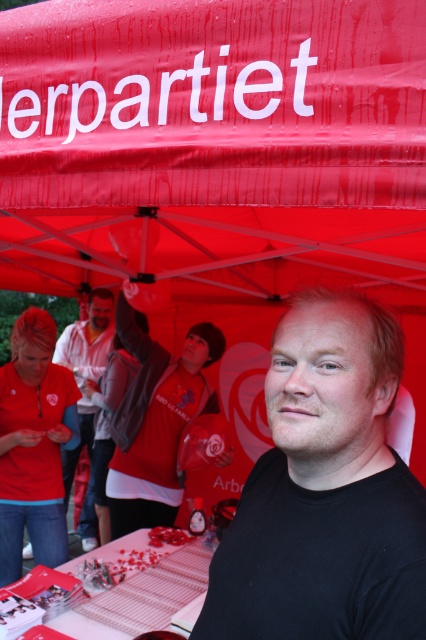
Between black matte shirt at center and matte plastic table at center, which one appears on the left side from the viewer's perspective?

Positioned to the left is matte plastic table at center.

How distant is black matte shirt at center from matte plastic table at center?

black matte shirt at center and matte plastic table at center are 1.14 meters apart from each other.

Does point (262, 500) come behind point (114, 592)?

No.

Find the location of a particular element. black matte shirt at center is located at coordinates [325, 492].

Does matte plastic table at center come behind matte white shirt at center?

No, it is not.

Is point (198, 582) in front of point (78, 324)?

Yes.

This screenshot has height=640, width=426. In order to click on matte plastic table at center in this screenshot , I will do `click(143, 596)`.

Which is behind, point (241, 557) or point (104, 362)?

Positioned behind is point (104, 362).

Does black matte shirt at center have a greater height compared to matte white shirt at center?

No, black matte shirt at center is not taller than matte white shirt at center.

Which is in front, point (290, 504) or point (103, 337)?

Point (290, 504) is more forward.

Locate an element on the screen. The image size is (426, 640). black matte shirt at center is located at coordinates (325, 492).